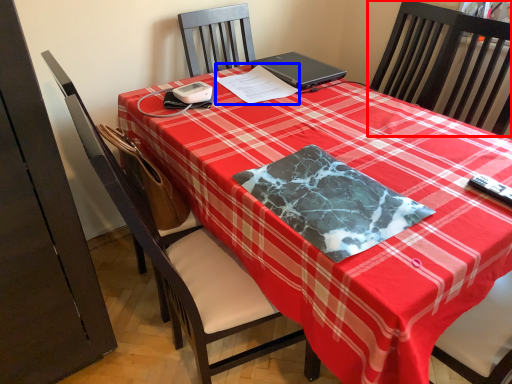
Question: Which point is further to the camera, chair (highlighted by a red box) or notepad (highlighted by a blue box)?

Choices:
 (A) chair
 (B) notepad

Answer: (B)